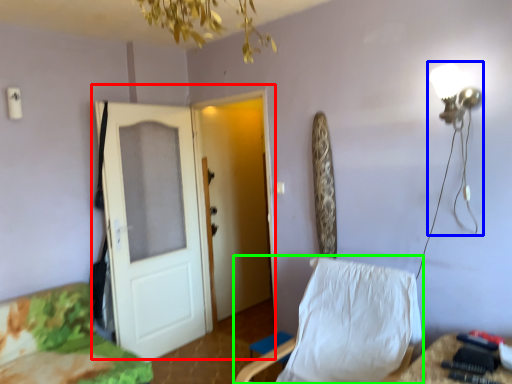
Question: Based on their relative distances, which object is farther from door (highlighted by a red box)? Choose from table lamp (highlighted by a blue box) and chair (highlighted by a green box).

Choices:
 (A) table lamp
 (B) chair

Answer: (A)